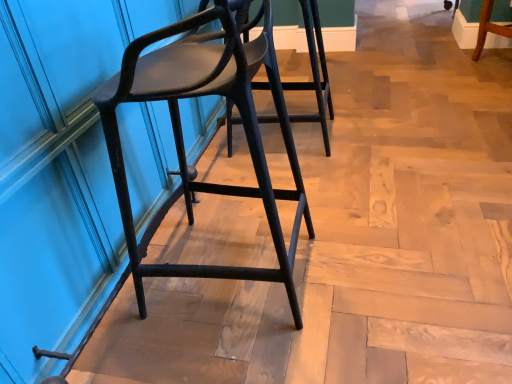
The height and width of the screenshot is (384, 512). Identify the location of free space on the front side of matte black chair at left. (249, 353).